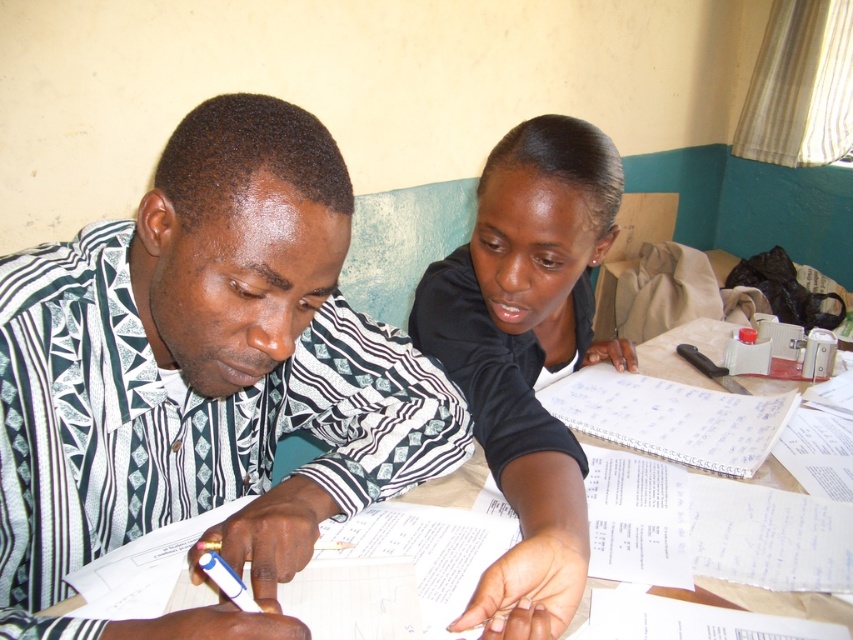
You are a photographer trying to capture a closeup of the white plastic pen at center. However, the black matte shirt at upper center is blocking your view. Can you move the pen closer to you so that it is no longer behind the shirt?

The black matte shirt at upper center is further to the viewer than white plastic pen at center, so the pen is actually behind the shirt. Moving the pen closer to you would place it in front of the shirt, making it visible without obstruction.

You are organizing a study group and need to arrange materials. If the black matte shirt at upper center is wider than the white paper at center, which object should you place first to ensure there is enough space for both?

Since the black matte shirt at upper center is wider than the white paper at center, you should place the black matte shirt at upper center first to accommodate its larger width, leaving sufficient space for the white paper at center.

You are organizing a study group and need to ensure everyone can see the materials clearly. Considering the black matte shirt at upper center and the white plastic pen at center, which object is bigger and might block the view of the pen?

The black matte shirt at upper center is larger in size compared to the white plastic pen at center, so it might block the view of the pen.